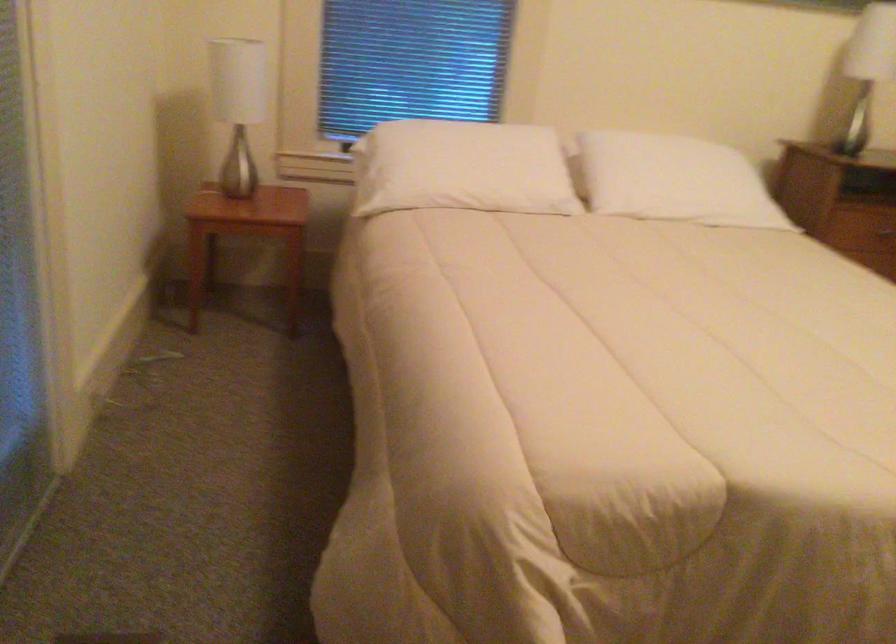
At what (x,y) coordinates should I click in order to perform the action: click on drawer handle. Please return your answer as a coordinate pair (x, y). The width and height of the screenshot is (896, 644). Looking at the image, I should click on (883, 232).